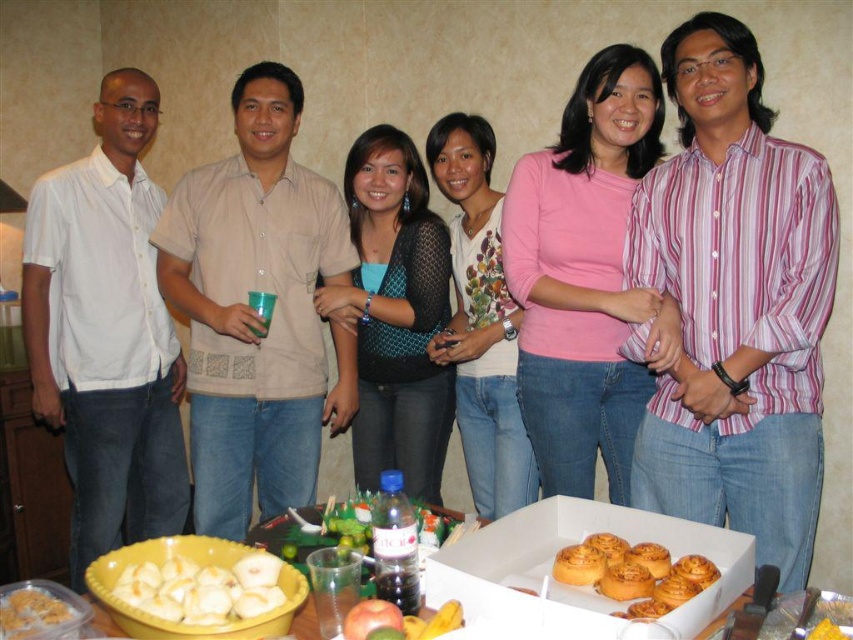
Based on the photo, who is more distant from viewer, (474, 214) or (555, 579)?

Positioned behind is point (474, 214).

Can you confirm if floral print shirt at center is thinner than golden brown doughnut at lower center?

No, floral print shirt at center is not thinner than golden brown doughnut at lower center.

Is point (508, 310) more distant than point (672, 570)?

Yes, it is.

Where is `floral print shirt at center`? floral print shirt at center is located at coordinates (480, 321).

The height and width of the screenshot is (640, 853). In order to click on yellow matte cake at lower left in this screenshot , I will do `click(202, 588)`.

Can you confirm if yellow matte cake at lower left is taller than golden brown doughnut at lower center?

Indeed, yellow matte cake at lower left has a greater height compared to golden brown doughnut at lower center.

Who is more distant from viewer, (195, 586) or (708, 582)?

The point (708, 582) is behind.

The width and height of the screenshot is (853, 640). I want to click on yellow matte cake at lower left, so click(x=202, y=588).

Who is positioned more to the right, floral print shirt at center or yellow cake at center?

yellow cake at center is more to the right.

Is point (450, 198) positioned behind point (830, 627)?

That is True.

Describe the element at coordinates (480, 321) in the screenshot. I see `floral print shirt at center` at that location.

You are a GUI agent. You are given a task and a screenshot of the screen. Output one action in this format:
    pyautogui.click(x=<x>, y=<y>)
    Task: Click on the floral print shirt at center
    This screenshot has height=640, width=853.
    Given the screenshot: What is the action you would take?
    pyautogui.click(x=480, y=321)